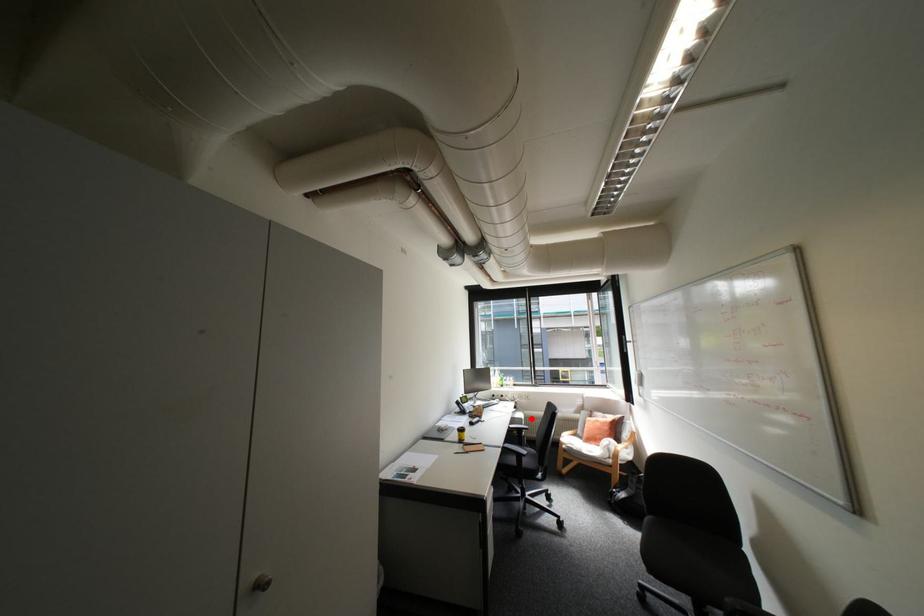
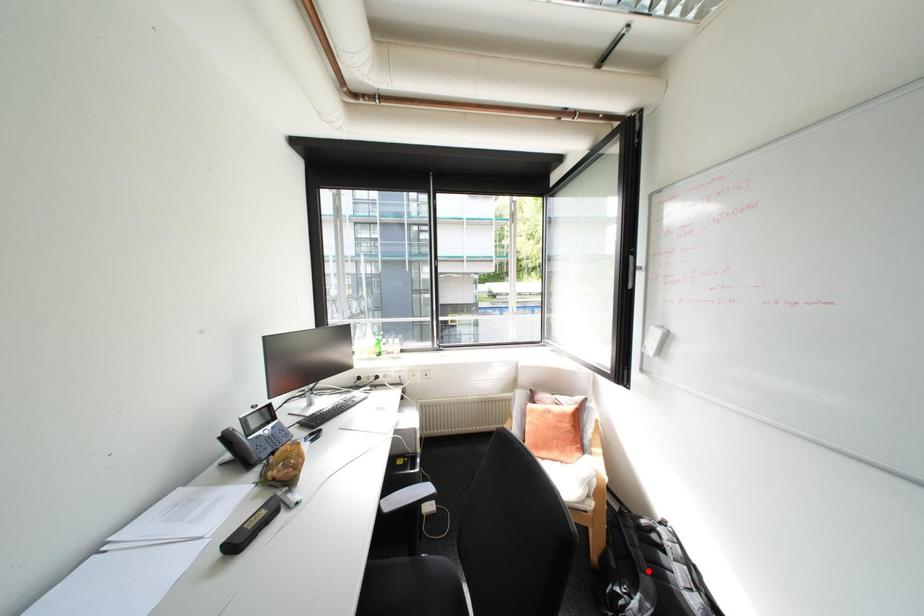
I am providing you with two images of the same scene from different viewpoints. A red point is marked on the first image and another point is marked on the second image. Is the red point in image1 aligned with the point shown in image2?

No